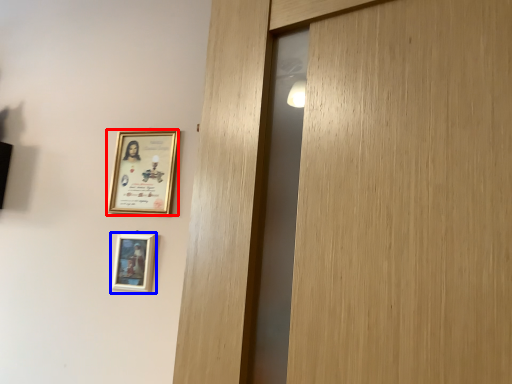
Question: Which of the following is the farthest to the observer, picture frame (highlighted by a red box) or picture frame (highlighted by a blue box)?

Choices:
 (A) picture frame
 (B) picture frame

Answer: (A)